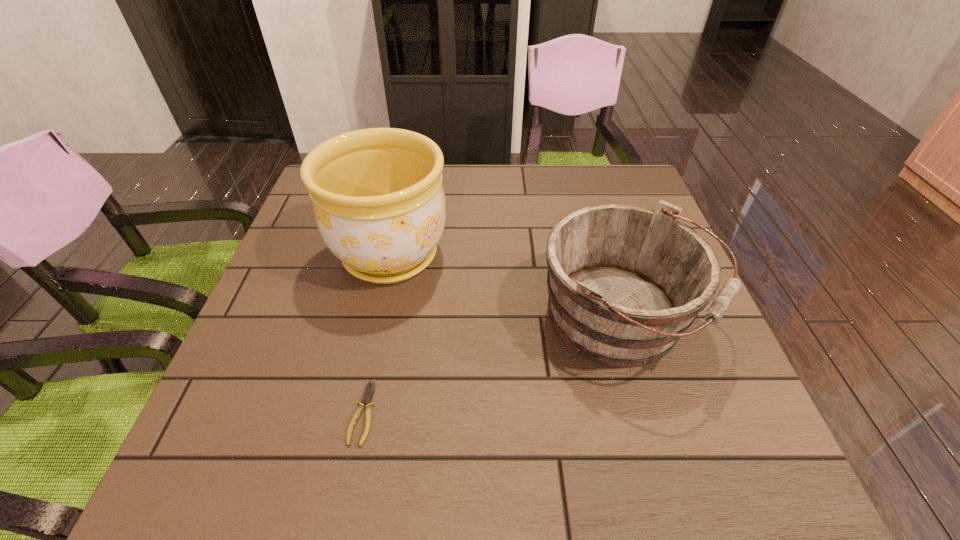
Find the location of a particular element. The height and width of the screenshot is (540, 960). flowerpot is located at coordinates (378, 200).

Where is `the rightmost object`? Image resolution: width=960 pixels, height=540 pixels. the rightmost object is located at coordinates (625, 282).

Locate an element on the screen. Image resolution: width=960 pixels, height=540 pixels. the second shortest object is located at coordinates (625, 282).

Locate an element on the screen. The image size is (960, 540). the shortest object is located at coordinates (367, 397).

At what (x,y) coordinates should I click in order to perform the action: click on vacant space located 0.390m on the right of the flowerpot. Please return your answer as a coordinate pair (x, y). Looking at the image, I should click on (610, 255).

You are a GUI agent. You are given a task and a screenshot of the screen. Output one action in this format:
    pyautogui.click(x=<x>, y=<y>)
    Task: Click on the free space located on the front of the second shortest object
    
    Given the screenshot: What is the action you would take?
    pyautogui.click(x=656, y=435)

Locate an element on the screen. The height and width of the screenshot is (540, 960). free space located 0.330m on the back of the pliers is located at coordinates (394, 262).

You are a GUI agent. You are given a task and a screenshot of the screen. Output one action in this format:
    pyautogui.click(x=<x>, y=<y>)
    Task: Click on the object present at the near edge
    
    Given the screenshot: What is the action you would take?
    pyautogui.click(x=367, y=397)

This screenshot has height=540, width=960. Identify the location of object located at the left edge. (378, 200).

This screenshot has height=540, width=960. I want to click on object that is at the right edge, so click(625, 282).